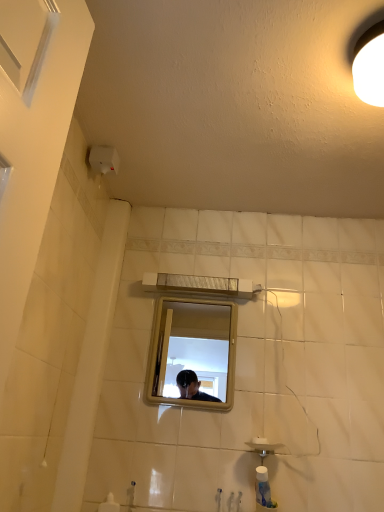
Question: Considering the positions of metallic rectangular mirror at center and matte silver faucet at lower center in the image, is metallic rectangular mirror at center wider or thinner than matte silver faucet at lower center?

Choices:
 (A) wide
 (B) thin

Answer: (B)

Question: From a real-world perspective, relative to matte silver faucet at lower center, is metallic rectangular mirror at center vertically above or below?

Choices:
 (A) above
 (B) below

Answer: (A)

Question: Which object is the closest to the metallic rectangular mirror at center?

Choices:
 (A) white matte light fixture at upper right
 (B) matte silver faucet at lower center

Answer: (B)

Question: Which object is the farthest from the white matte light fixture at upper right?

Choices:
 (A) metallic rectangular mirror at center
 (B) matte silver faucet at lower center

Answer: (A)